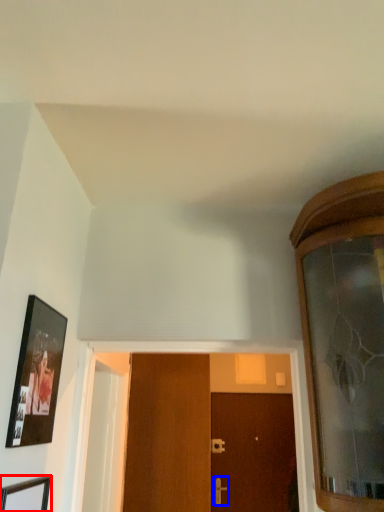
Question: Which of the following is the closest to the observer, picture frame (highlighted by a red box) or door handle (highlighted by a blue box)?

Choices:
 (A) picture frame
 (B) door handle

Answer: (A)